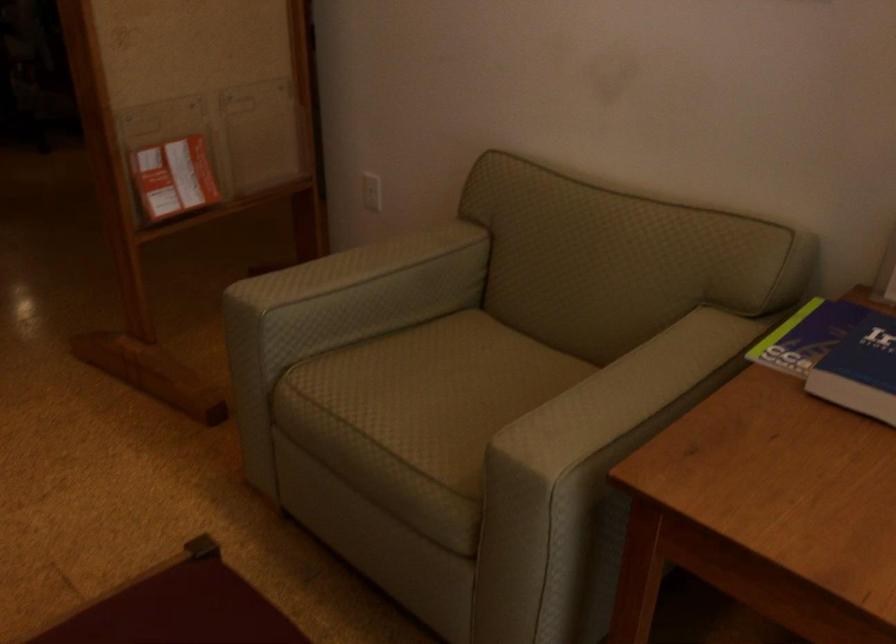
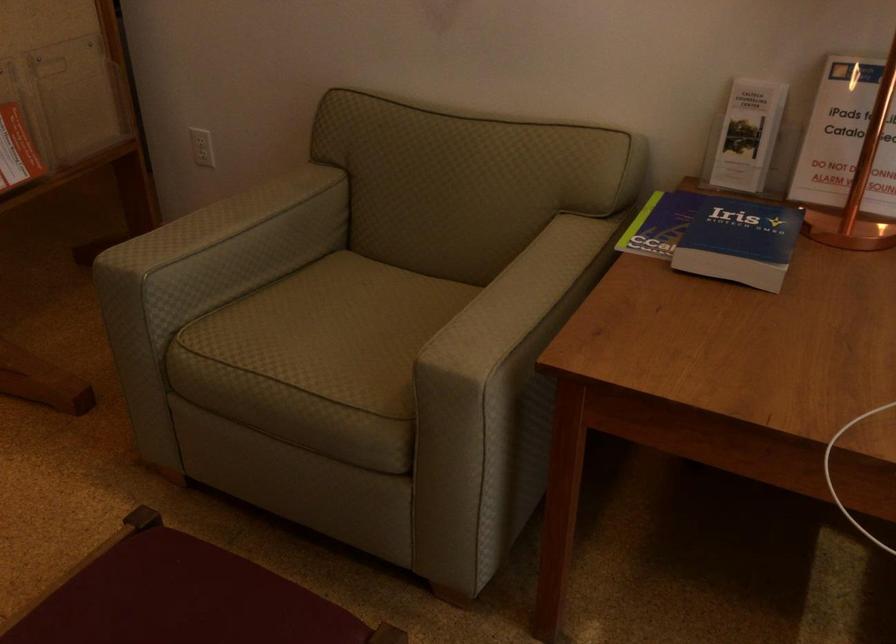
Where in the second image is the point corresponding to point (366, 190) from the first image?

(202, 147)